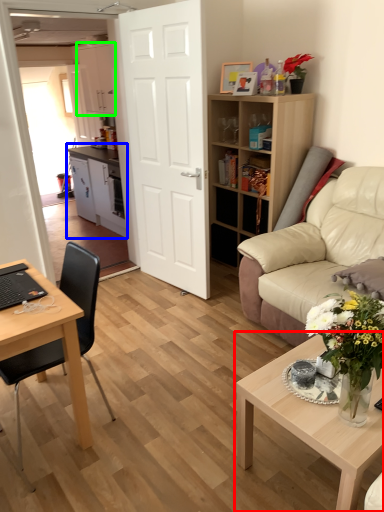
Question: Estimate the real-world distances between objects in this image. Which object is farther from coffee table (highlighted by a red box), cabinetry (highlighted by a blue box) or cabinetry (highlighted by a green box)?

Choices:
 (A) cabinetry
 (B) cabinetry

Answer: (B)